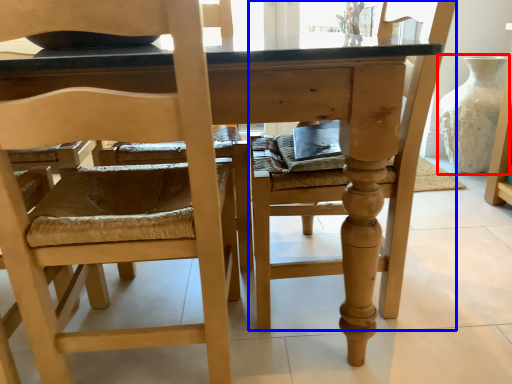
Question: Among these objects, which one is farthest to the camera, glass vase (highlighted by a red box) or chair (highlighted by a blue box)?

Choices:
 (A) glass vase
 (B) chair

Answer: (A)